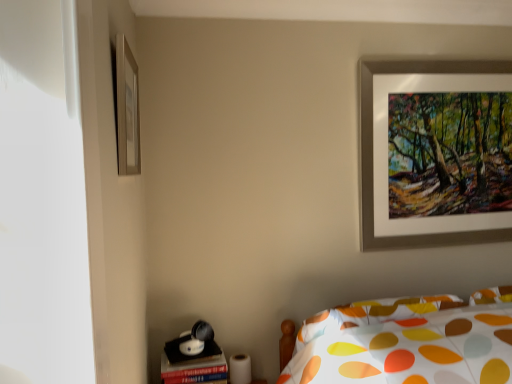
Where is `silver metallic picture frame at upper left, marked as the 1th picture frame in a left-to-right arrangement`? This screenshot has width=512, height=384. silver metallic picture frame at upper left, marked as the 1th picture frame in a left-to-right arrangement is located at coordinates (127, 109).

Find the location of a particular element. silver metallic picture frame at upper left, positioned as the second picture frame in right-to-left order is located at coordinates (127, 109).

Is matte black table at lower left taller or shorter than silver metallic picture frame at upper right, which is counted as the second picture frame, starting from the front?

In the image, matte black table at lower left appears to be shorter than silver metallic picture frame at upper right, which is counted as the second picture frame, starting from the front.

Which object is thinner, matte black table at lower left or silver metallic picture frame at upper right, which is counted as the second picture frame, starting from the front?

Thinner between the two is silver metallic picture frame at upper right, which is counted as the second picture frame, starting from the front.

Is matte black table at lower left beside silver metallic picture frame at upper right, the 1th picture frame when ordered from back to front?

No, matte black table at lower left is not beside silver metallic picture frame at upper right, the 1th picture frame when ordered from back to front.

From the image's perspective, is silver metallic picture frame at upper right, acting as the second picture frame starting from the left, under silver metallic picture frame at upper left, which ranks as the 2th picture frame in back-to-front order?

Yes, from the image's perspective, silver metallic picture frame at upper right, acting as the second picture frame starting from the left, is below silver metallic picture frame at upper left, which ranks as the 2th picture frame in back-to-front order.

Is silver metallic picture frame at upper right, the 1th picture frame when ordered from back to front, behind silver metallic picture frame at upper left, which ranks as the 2th picture frame in back-to-front order?

Yes.

From a real-world perspective, is silver metallic picture frame at upper right, which is counted as the second picture frame, starting from the front, above or below silver metallic picture frame at upper left, positioned as the second picture frame in right-to-left order?

silver metallic picture frame at upper right, which is counted as the second picture frame, starting from the front, is situated lower than silver metallic picture frame at upper left, positioned as the second picture frame in right-to-left order, in the real world.

Which of these two, matte black table at lower left or silver metallic picture frame at upper left, positioned as the second picture frame in right-to-left order, is wider?

Wider between the two is matte black table at lower left.

From a real-world perspective, which object rests below the other?

matte black table at lower left, from a real-world perspective.

Which is closer, [192,374] or [123,56]?

The point [123,56] is closer.

Who is smaller, matte black table at lower left or silver metallic picture frame at upper left, marked as the 1th picture frame in a left-to-right arrangement?

silver metallic picture frame at upper left, marked as the 1th picture frame in a left-to-right arrangement.

Is the position of silver metallic picture frame at upper right, the 1th picture frame when ordered from back to front, less distant than that of matte black table at lower left?

No, it is behind matte black table at lower left.

Who is shorter, silver metallic picture frame at upper right, the 1th picture frame when ordered from back to front, or matte black table at lower left?

Standing shorter between the two is matte black table at lower left.

Is silver metallic picture frame at upper right, which is counted as the second picture frame, starting from the front, at the right side of matte black table at lower left?

Indeed, silver metallic picture frame at upper right, which is counted as the second picture frame, starting from the front, is positioned on the right side of matte black table at lower left.

From the image's perspective, who appears lower, silver metallic picture frame at upper right, acting as the second picture frame starting from the left, or matte black table at lower left?

matte black table at lower left appears lower in the image.

Which of these two, silver metallic picture frame at upper left, positioned as the second picture frame in right-to-left order, or matte black table at lower left, is smaller?

silver metallic picture frame at upper left, positioned as the second picture frame in right-to-left order, is smaller.

Considering the relative positions of silver metallic picture frame at upper left, marked as the 1th picture frame in a left-to-right arrangement, and matte black table at lower left in the image provided, is silver metallic picture frame at upper left, marked as the 1th picture frame in a left-to-right arrangement, in front of matte black table at lower left?

Yes, silver metallic picture frame at upper left, marked as the 1th picture frame in a left-to-right arrangement, is closer to the viewer.

Is silver metallic picture frame at upper left, acting as the first picture frame starting from the front, taller or shorter than matte black table at lower left?

Considering their sizes, silver metallic picture frame at upper left, acting as the first picture frame starting from the front, has more height than matte black table at lower left.

Would you say silver metallic picture frame at upper left, acting as the first picture frame starting from the front, is outside matte black table at lower left?

silver metallic picture frame at upper left, acting as the first picture frame starting from the front, lies outside matte black table at lower left's area.

Is silver metallic picture frame at upper left, marked as the 1th picture frame in a left-to-right arrangement, further to camera compared to silver metallic picture frame at upper right, which is counted as the second picture frame, starting from the front?

No, silver metallic picture frame at upper left, marked as the 1th picture frame in a left-to-right arrangement, is in front of silver metallic picture frame at upper right, which is counted as the second picture frame, starting from the front.

Is silver metallic picture frame at upper left, acting as the first picture frame starting from the front, not near silver metallic picture frame at upper right, which is counted as the second picture frame, starting from the front?

Yes.

Is silver metallic picture frame at upper left, positioned as the second picture frame in right-to-left order, wider than silver metallic picture frame at upper right, the 1th picture frame when ordered from back to front?

Incorrect, the width of silver metallic picture frame at upper left, positioned as the second picture frame in right-to-left order, does not surpass that of silver metallic picture frame at upper right, the 1th picture frame when ordered from back to front.

Identify the location of table on the left of silver metallic picture frame at upper right, the 1th picture frame when ordered from back to front. The height and width of the screenshot is (384, 512). (193, 365).

In order to click on picture frame beneath the silver metallic picture frame at upper left, positioned as the second picture frame in right-to-left order (from a real-world perspective) in this screenshot , I will do `click(372, 142)`.

Based on their spatial positions, is silver metallic picture frame at upper right, which is counted as the second picture frame, starting from the front, or matte black table at lower left closer to silver metallic picture frame at upper left, marked as the 1th picture frame in a left-to-right arrangement?

matte black table at lower left lies closer to silver metallic picture frame at upper left, marked as the 1th picture frame in a left-to-right arrangement, than the other object.

Based on their spatial positions, is matte black table at lower left or silver metallic picture frame at upper right, which ranks as the first picture frame in right-to-left order, closer to silver metallic picture frame at upper left, which ranks as the 2th picture frame in back-to-front order?

Among the two, matte black table at lower left is located nearer to silver metallic picture frame at upper left, which ranks as the 2th picture frame in back-to-front order.

Looking at the image, which one is located further to matte black table at lower left, silver metallic picture frame at upper left, marked as the 1th picture frame in a left-to-right arrangement, or silver metallic picture frame at upper right, the 1th picture frame when ordered from back to front?

silver metallic picture frame at upper right, the 1th picture frame when ordered from back to front.

Which object lies nearer to the anchor point silver metallic picture frame at upper right, which ranks as the first picture frame in right-to-left order, matte black table at lower left or silver metallic picture frame at upper left, acting as the first picture frame starting from the front?

Among the two, matte black table at lower left is located nearer to silver metallic picture frame at upper right, which ranks as the first picture frame in right-to-left order.

Which object lies further to the anchor point matte black table at lower left, silver metallic picture frame at upper right, the 1th picture frame when ordered from back to front, or silver metallic picture frame at upper left, acting as the first picture frame starting from the front?

silver metallic picture frame at upper right, the 1th picture frame when ordered from back to front, is positioned further to the anchor matte black table at lower left.

Consider the image. From the image, which object appears to be nearer to silver metallic picture frame at upper right, which ranks as the first picture frame in right-to-left order, silver metallic picture frame at upper left, positioned as the second picture frame in right-to-left order, or matte black table at lower left?

The object closer to silver metallic picture frame at upper right, which ranks as the first picture frame in right-to-left order, is matte black table at lower left.

At what (x,y) coordinates should I click in order to perform the action: click on table located between silver metallic picture frame at upper left, positioned as the second picture frame in right-to-left order, and silver metallic picture frame at upper right, acting as the second picture frame starting from the left, in the left-right direction. Please return your answer as a coordinate pair (x, y). The height and width of the screenshot is (384, 512). Looking at the image, I should click on (193, 365).